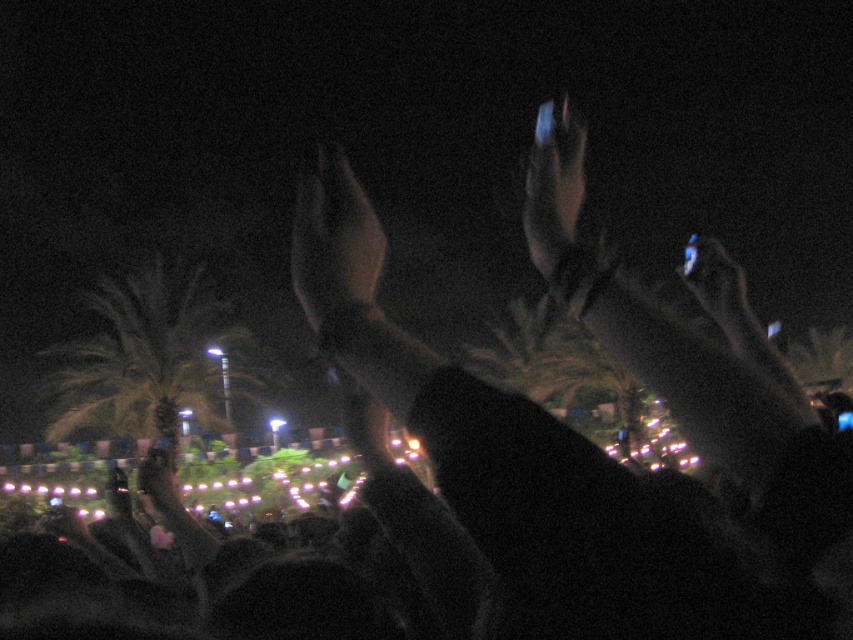
Is black matte hands at upper center positioned before matte black hand at center?

Yes, it is in front of matte black hand at center.

Does black matte hands at upper center have a greater width compared to matte black hand at center?

No, black matte hands at upper center is not wider than matte black hand at center.

Which is in front, point (596, 500) or point (329, 156)?

Point (596, 500) is more forward.

You are a GUI agent. You are given a task and a screenshot of the screen. Output one action in this format:
    pyautogui.click(x=<x>, y=<y>)
    Task: Click on the black matte hands at upper center
    This screenshot has height=640, width=853.
    Given the screenshot: What is the action you would take?
    pyautogui.click(x=601, y=452)

Between point (647, 600) and point (189, 371), which one is positioned behind?

Positioned behind is point (189, 371).

Does black matte hands at upper center appear on the right side of green leafy palm tree at left?

Correct, you'll find black matte hands at upper center to the right of green leafy palm tree at left.

What do you see at coordinates (601, 452) in the screenshot? I see `black matte hands at upper center` at bounding box center [601, 452].

This screenshot has height=640, width=853. Identify the location of black matte hands at upper center. (601, 452).

Can you confirm if matte black hand at center is wider than shiny metallic hand at upper center?

Incorrect, matte black hand at center's width does not surpass shiny metallic hand at upper center's.

Does matte black hand at center have a lesser width compared to shiny metallic hand at upper center?

Yes.

Who is more distant from viewer, [312,257] or [543,144]?

The point [543,144] is more distant.

I want to click on matte black hand at center, so click(x=334, y=240).